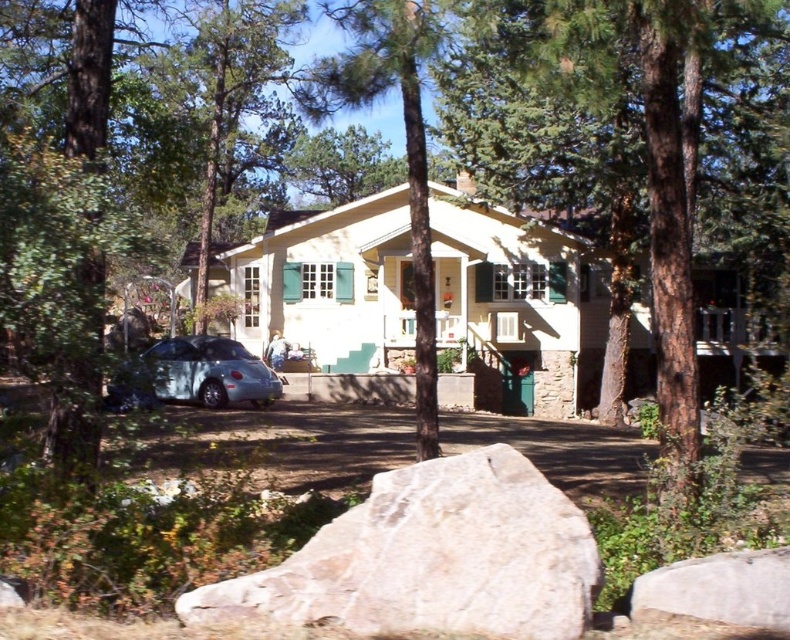
Is yellow matte house at center taller than satin silver car at left?

Yes.

Does yellow matte house at center lie behind satin silver car at left?

Yes, it is behind satin silver car at left.

Between point (350, 243) and point (149, 364), which one is positioned in front?

Positioned in front is point (149, 364).

The height and width of the screenshot is (640, 790). I want to click on yellow matte house at center, so click(517, 307).

Consider the image. Can you confirm if gray asphalt driveway at center is bigger than satin silver car at left?

Correct, gray asphalt driveway at center is larger in size than satin silver car at left.

Identify the location of gray asphalt driveway at center. (273, 442).

Does point (644, 442) come in front of point (175, 365)?

Yes.

This screenshot has width=790, height=640. What are the coordinates of `gray asphalt driveway at center` in the screenshot? It's located at pyautogui.click(x=273, y=442).

Who is shorter, white rough rock at lower center or green textured tree at center?

white rough rock at lower center is shorter.

Is white rough rock at lower center wider than green textured tree at center?

No.

Image resolution: width=790 pixels, height=640 pixels. I want to click on white rough rock at lower center, so tap(431, 557).